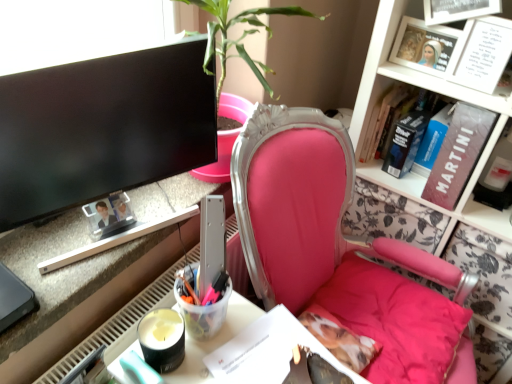
Question: Does point (417, 114) appear closer or farther from the camera than point (458, 57)?

Choices:
 (A) farther
 (B) closer

Answer: (A)

Question: Is hardcover book at upper right, which ranks as the 4th book in front-to-back order, taller or shorter than white paper at upper right, arranged as the first book when viewed from the front?

Choices:
 (A) tall
 (B) short

Answer: (A)

Question: Considering the real-world distances, which object is closest to the translucent plastic cup at lower center?

Choices:
 (A) black glossy monitor at upper left
 (B) hardcover book at upper right, placed as the 2th book when sorted from back to front
 (C) blue hardcover book at upper right, which is the 3th book in back-to-front order
 (D) maroon matte book at upper right, the 2th book positioned from the front
 (E) pink fabric chair at center

Answer: (A)

Question: Which of these objects is positioned closest to the metallic silver desk at lower left?

Choices:
 (A) blue hardcover book at upper right, acting as the third book starting from the front
 (B) white paper at upper right, acting as the fifth book starting from the back
 (C) hardcover book at upper right, acting as the 5th book starting from the front
 (D) maroon matte book at upper right, which ranks as the fourth book in back-to-front order
 (E) pink fabric chair at center

Answer: (E)